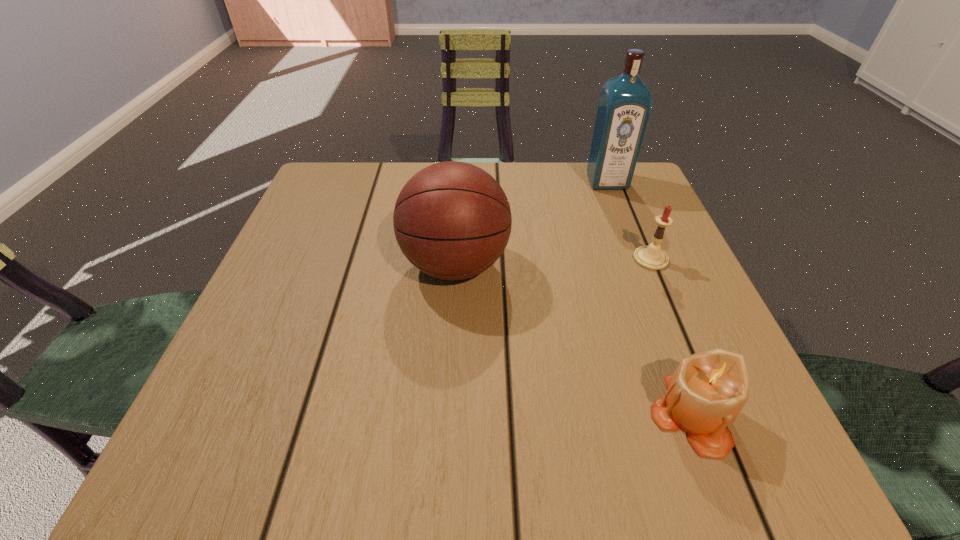
This screenshot has height=540, width=960. In the image, there is a desktop. In order to click on vacant space at the far right corner in this screenshot , I will do `click(630, 190)`.

Where is `vacant space at the near right corner of the desktop`? vacant space at the near right corner of the desktop is located at coordinates (660, 444).

You are a GUI agent. You are given a task and a screenshot of the screen. Output one action in this format:
    pyautogui.click(x=<x>, y=<y>)
    Task: Click on the free point between the basketball and the farther candle
    The width and height of the screenshot is (960, 540).
    Given the screenshot: What is the action you would take?
    pyautogui.click(x=553, y=262)

Locate an element on the screen. This screenshot has height=540, width=960. free space between the farther candle and the nearest object is located at coordinates (671, 336).

I want to click on vacant point located between the nearest object and the farther candle, so click(671, 336).

You are a GUI agent. You are given a task and a screenshot of the screen. Output one action in this format:
    pyautogui.click(x=<x>, y=<y>)
    Task: Click on the free space between the farther candle and the farthest object
    
    Given the screenshot: What is the action you would take?
    pyautogui.click(x=629, y=220)

At what (x,y) coordinates should I click in order to perform the action: click on free spot between the nearest object and the farthest object. Please return your answer as a coordinate pair (x, y). The width and height of the screenshot is (960, 540). Looking at the image, I should click on (649, 298).

Locate an element on the screen. This screenshot has width=960, height=540. vacant area that lies between the farther candle and the basketball is located at coordinates (553, 262).

Image resolution: width=960 pixels, height=540 pixels. Identify the location of vacant space that is in between the nearest object and the leftmost object. (573, 340).

You are a GUI agent. You are given a task and a screenshot of the screen. Output one action in this format:
    pyautogui.click(x=<x>, y=<y>)
    Task: Click on the free space between the leftmost object and the farthest object
    This screenshot has height=540, width=960.
    Given the screenshot: What is the action you would take?
    pyautogui.click(x=531, y=223)